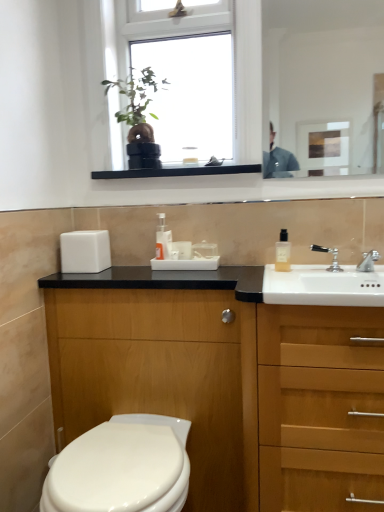
Question: Considering their positions, is wooden cabinet at right located in front of or behind transparent glass window at upper center?

Choices:
 (A) behind
 (B) front

Answer: (B)

Question: Does point (382, 392) appear closer or farther from the camera than point (248, 38)?

Choices:
 (A) farther
 (B) closer

Answer: (B)

Question: Based on their relative distances, which object is farther from the clear glass bottle at upper right, the second toiletry viewed from the back?

Choices:
 (A) silver metallic faucet at sink right, placed as the 1th tap when sorted from left to right
 (B) white glossy toilet at lower left
 (C) silver metallic faucet at right, the 1th tap viewed from the right
 (D) transparent glass window at upper center
 (E) wooden cabinet at right

Answer: (B)

Question: Considering the real-world distances, which object is closest to the wooden cabinet at right?

Choices:
 (A) white glossy mirror at upper right
 (B) wooden drawer at right
 (C) transparent glass window at upper center
 (D) translucent plastic soap dispenser at center, marked as the first toiletry in a back-to-front arrangement
 (E) green matte plant at upper center

Answer: (B)